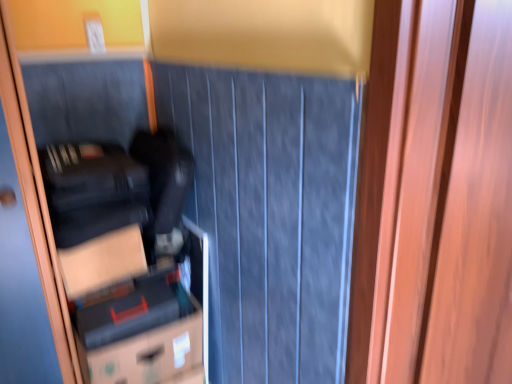
Measure the distance between point (413,212) and camera.

The distance of point (413,212) from camera is 33.07 inches.

Describe the element at coordinates (447, 200) in the screenshot. I see `wooden screen door at right` at that location.

Where is `wooden screen door at right`? This screenshot has width=512, height=384. wooden screen door at right is located at coordinates (447, 200).

What is the approximate width of wooden screen door at right?

It is 4.58 inches.

Identify the location of wooden screen door at right. The image size is (512, 384). (447, 200).